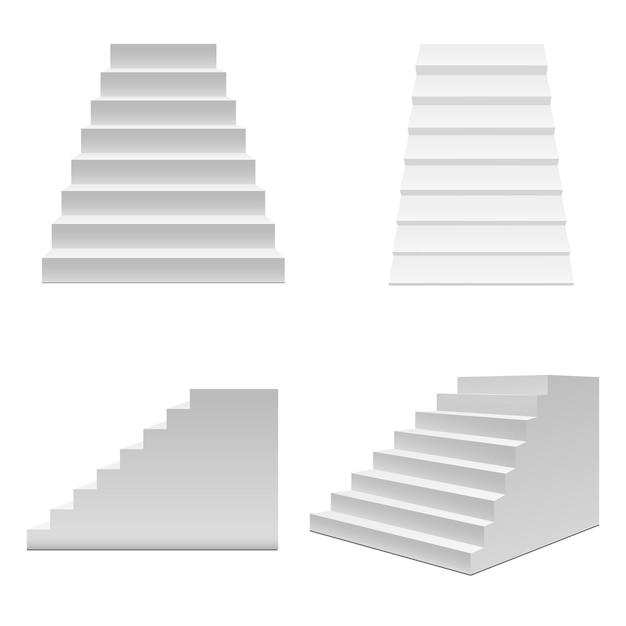
Locate an element on the screen. step on upper right staircase is located at coordinates (505, 269), (508, 240), (501, 207), (501, 183), (494, 150), (495, 120), (489, 89), (489, 62).